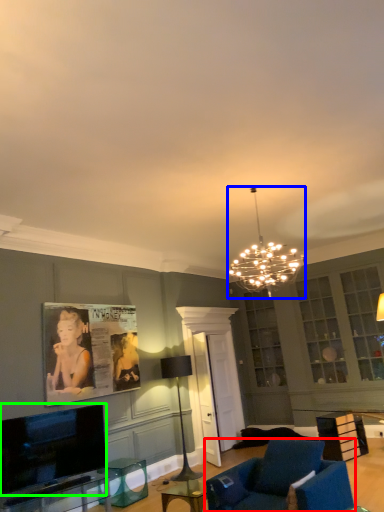
Question: Based on their relative distances, which object is nearer to chair (highlighted by a red box)? Choose from lamp (highlighted by a blue box) and television (highlighted by a green box).

Choices:
 (A) lamp
 (B) television

Answer: (B)